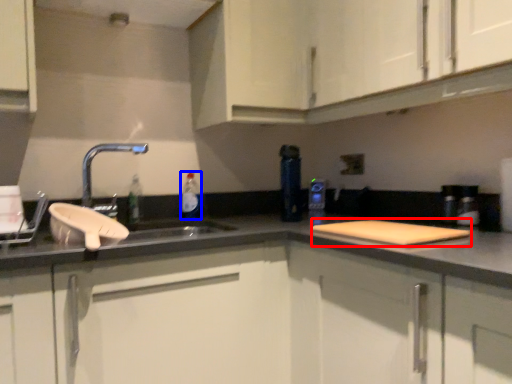
Question: Which of the following is the farthest to the observer, cutting board (highlighted by a red box) or bottle (highlighted by a blue box)?

Choices:
 (A) cutting board
 (B) bottle

Answer: (B)